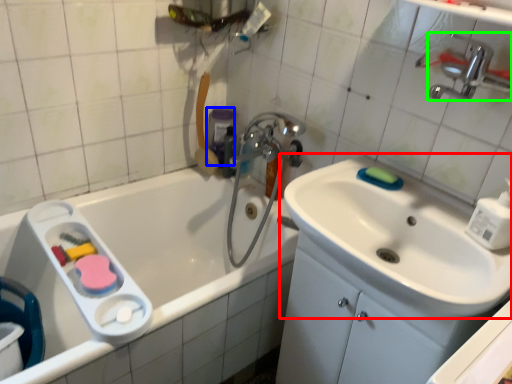
Question: Which is nearer to the sink (highlighted by a red box)? mouthwash (highlighted by a blue box) or tap (highlighted by a green box).

Choices:
 (A) mouthwash
 (B) tap

Answer: (B)